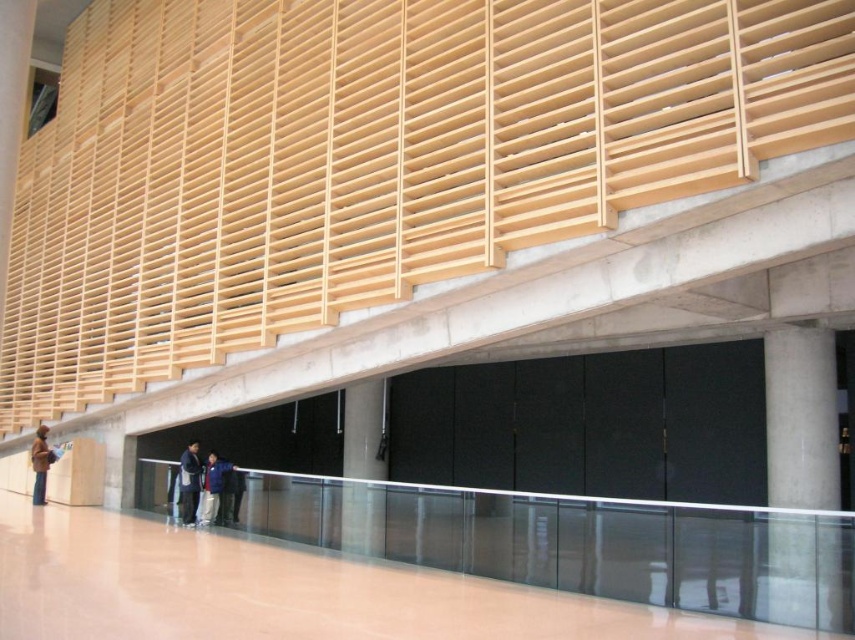
Between blue fabric jacket at lower center and brown leather jacket at lower left, which one has more height?

brown leather jacket at lower left

Is blue fabric jacket at lower center further to camera compared to brown leather jacket at lower left?

No, it is not.

Identify the location of blue fabric jacket at lower center. (211, 486).

Find the location of a particular element. Image resolution: width=855 pixels, height=640 pixels. blue fabric jacket at lower center is located at coordinates (211, 486).

Is concrete column at center further to the viewer compared to dark blue jacket at center?

No.

Which is behind, point (381, 417) or point (184, 509)?

Point (381, 417)

The image size is (855, 640). I want to click on concrete column at center, so click(x=363, y=468).

Can you confirm if concrete column at center is shorter than brown leather jacket at lower left?

Incorrect, concrete column at center's height does not fall short of brown leather jacket at lower left's.

Is concrete column at center further to camera compared to brown leather jacket at lower left?

No, concrete column at center is closer to the viewer.

What are the coordinates of `concrete column at center` in the screenshot? It's located at [363, 468].

The height and width of the screenshot is (640, 855). Identify the location of concrete column at center. (363, 468).